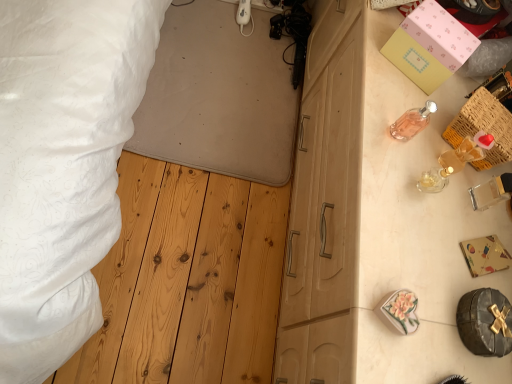
You are a GUI agent. You are given a task and a screenshot of the screen. Output one action in this format:
    pyautogui.click(x=<x>, y=<y>)
    Task: Click on the free space above white textured bed at upper left (from a real-world perspective)
    The image size is (512, 384).
    Given the screenshot: What is the action you would take?
    pyautogui.click(x=217, y=82)